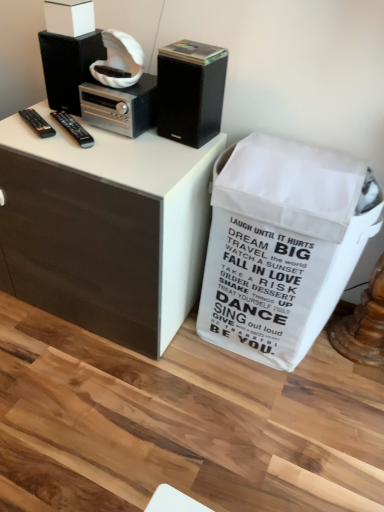
Question: Is black plastic remote at left, the 2th remote control from the right, bigger or smaller than white matte box at upper left?

Choices:
 (A) small
 (B) big

Answer: (A)

Question: Is point (26, 112) positioned closer to the camera than point (64, 2)?

Choices:
 (A) farther
 (B) closer

Answer: (A)

Question: Which object is the closest to the black matte speaker at upper left, which is the 1th loudspeaker in left-to-right order?

Choices:
 (A) white matte trash bin/can at lower right
 (B) silver metallic stereo at upper center
 (C) white matte box at upper left
 (D) black plastic remote at left, arranged as the first remote control when viewed from the left
 (E) black plastic remote at left, which is counted as the first remote control, starting from the right

Answer: (C)

Question: Which object is the farthest from the black plastic remote at left, which is counted as the first remote control, starting from the right?

Choices:
 (A) silver metallic stereo at upper center
 (B) black matte speaker at upper left, which is the 1th loudspeaker in left-to-right order
 (C) white matte box at upper left
 (D) black plastic remote at left, the 2th remote control from the right
 (E) black matte speaker at upper right, the 2th loudspeaker viewed from the left

Answer: (E)